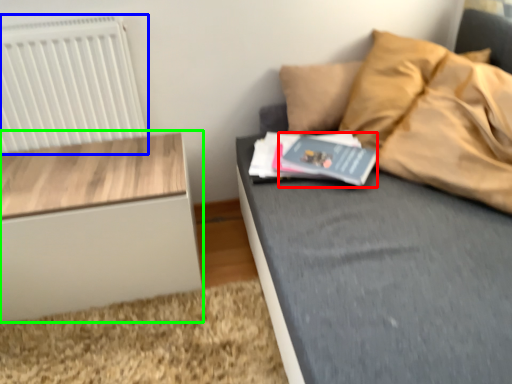
Question: Considering the real-world distances, which object is closest to paperback book (highlighted by a red box)? radiator (highlighted by a blue box) or nightstand (highlighted by a green box).

Choices:
 (A) radiator
 (B) nightstand

Answer: (B)